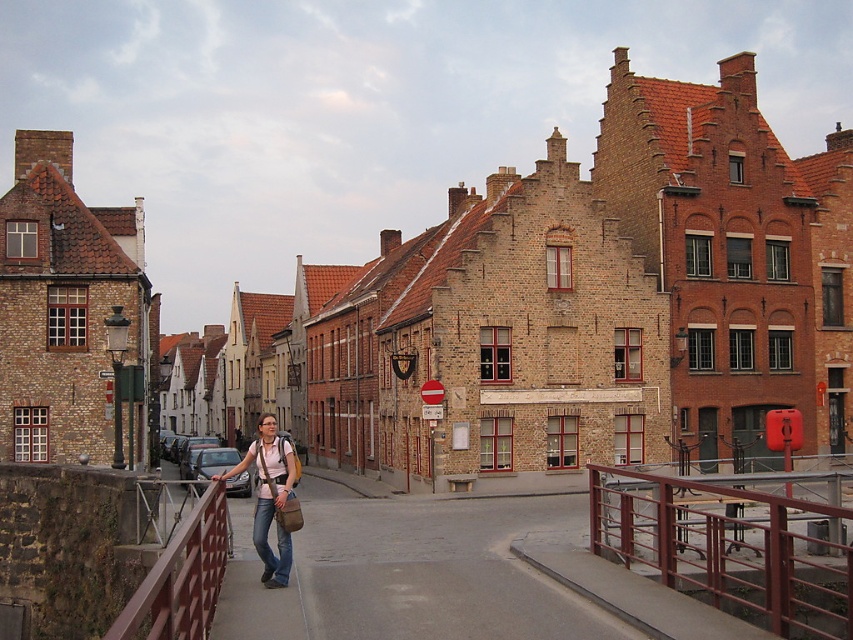
Looking at this image, you are a tourist standing on the street and want to take a photo of the brown brick building at center and the matte pink shirt at center. Which object should you focus on first if you want to capture both in a single frame without moving the camera?

The brown brick building at center is larger in size than the matte pink shirt at center, so you should focus on the brown brick building at center first to ensure it fits properly in the frame before adjusting for the smaller matte pink shirt at center.

You are standing on the street in the historic European town and see two points marked on the ground. The first point is at coordinate point (x=672, y=161) and the second is at point (x=177, y=580). If you are facing the direction the street curves to the right, which point is closer to you?

Point (x=177, y=580) is closer to you because point (x=672, y=161) is behind it according to the spatial description.

You are standing at the entrance of the street and want to reach the brown brick building at center. Which direction should you head towards?

The brown brick building at center is located at point (587, 305), so you should head towards the center of the street to reach it.